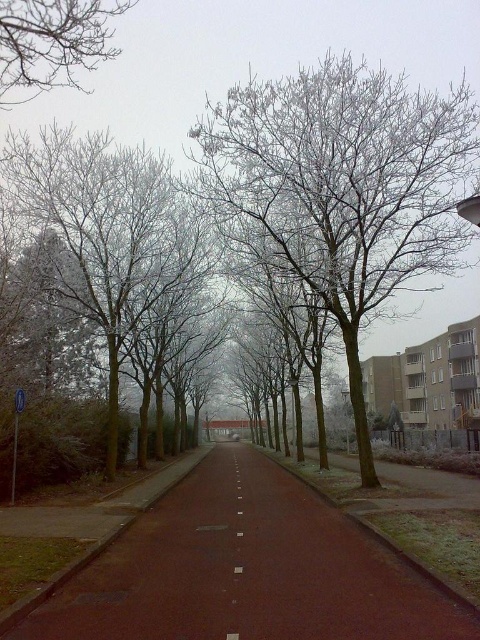
Question: Can you confirm if white frosty tree at center is positioned to the left of bare branches at upper left?

Choices:
 (A) yes
 (B) no

Answer: (B)

Question: Which is nearer to the bare branches at upper left?

Choices:
 (A) frosted branches at left
 (B) white matte line at center
 (C) white frosty tree at center
 (D) brown asphalt path at center

Answer: (A)

Question: Is frosted branches at left below bare branches at upper left?

Choices:
 (A) yes
 (B) no

Answer: (A)

Question: Observing the image, what is the correct spatial positioning of white frosty tree at center in reference to white matte line at center?

Choices:
 (A) left
 (B) right

Answer: (B)

Question: Which point appears farthest from the camera in this image?

Choices:
 (A) (34, 17)
 (B) (229, 636)

Answer: (A)

Question: Based on their relative distances, which object is farther from the white frosty tree at center?

Choices:
 (A) bare branches at upper left
 (B) brown asphalt path at center
 (C) white matte line at center
 (D) frosted branches at left

Answer: (C)